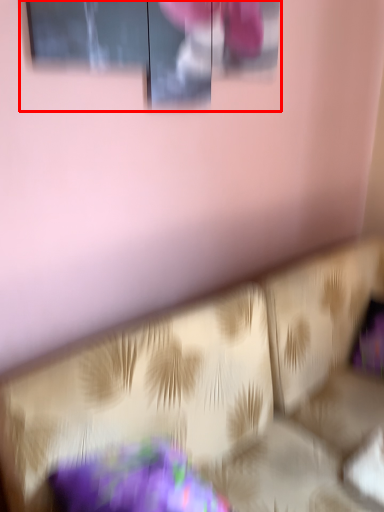
Question: Considering the relative positions of window (annotated by the red box) and furniture in the image provided, where is window (annotated by the red box) located with respect to the staircase?

Choices:
 (A) right
 (B) left

Answer: (B)